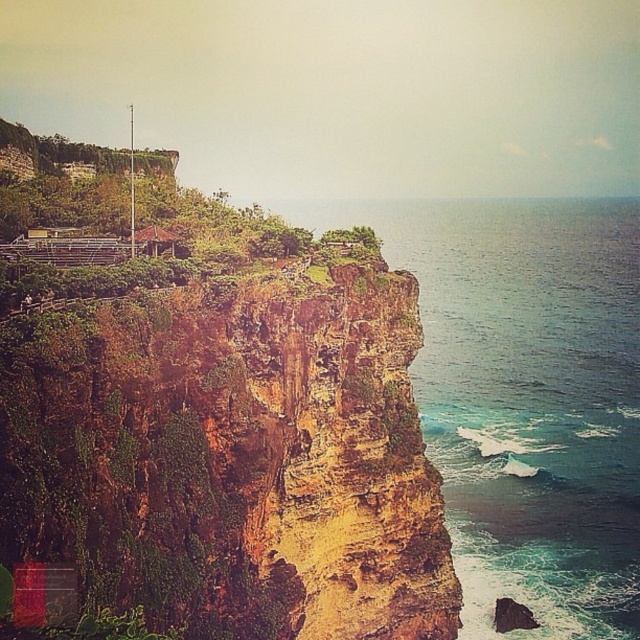
Is point (163, 216) positioned after point (474, 364)?

No, (163, 216) is in front of (474, 364).

Can you confirm if rusty rock cliff at left is shorter than greenish-blue water at cliff edge?

Yes, rusty rock cliff at left is shorter than greenish-blue water at cliff edge.

Does point (326, 308) come behind point (458, 433)?

No, (326, 308) is in front of (458, 433).

The width and height of the screenshot is (640, 640). Find the location of `rusty rock cliff at left`. rusty rock cliff at left is located at coordinates (211, 419).